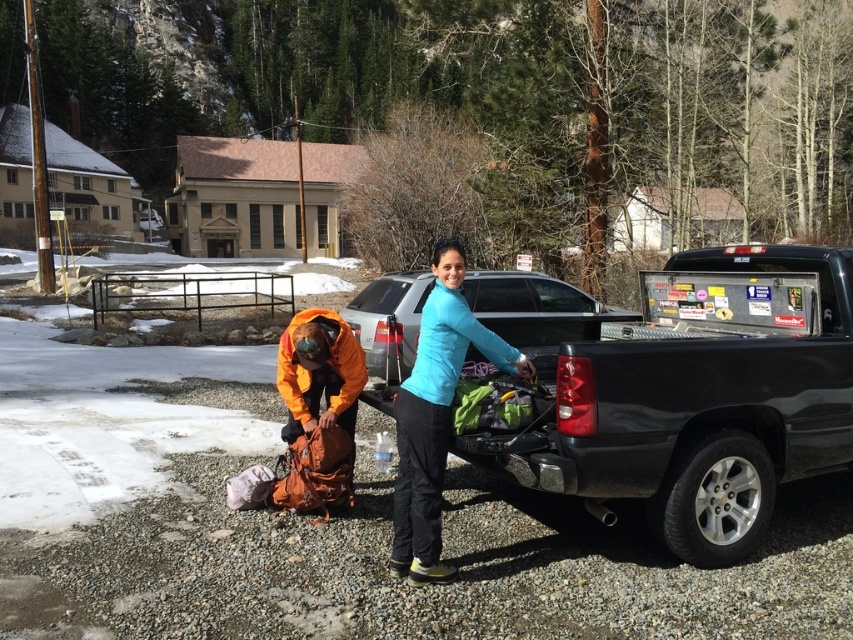
You are standing at point (428, 420) and want to walk to point (544, 483). Based on the scene description, will you need to walk forward or backward to reach your destination?

Since point (544, 483) is behind point (428, 420), you will need to walk backward to reach it.

You are trying to load camping gear into the truck bed. The matte black truck bed at center and the blue matte jacket at center are both visible. Which object is closer to you?

The matte black truck bed at center is closer to you because it is in front of the blue matte jacket at center.